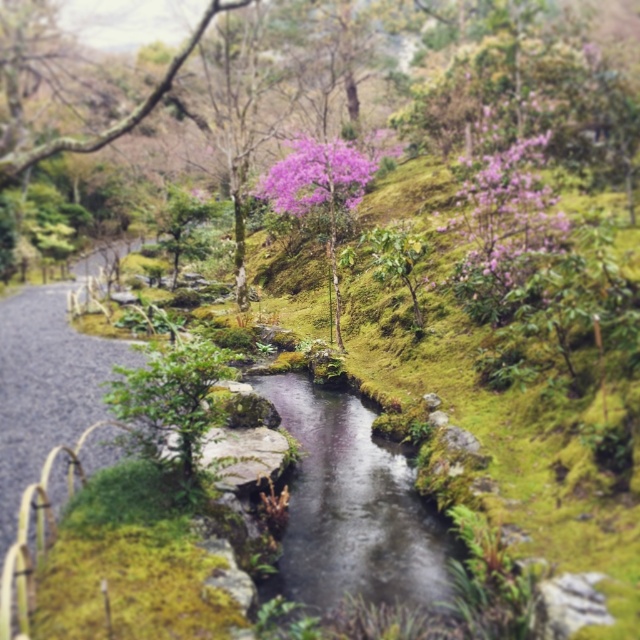
You are a hiker who wants to cross the clear water stream at center without getting your shoes wet. There is a purple matte flower at center nearby. Which object is shorter, allowing you to step over it easily?

The clear water stream at center has a lesser height compared to the purple matte flower at center. Therefore, the clear water stream at center is shorter and easier to step over without getting your shoes wet.

You are a hiker standing on the gravel path and want to pick both the purple matte flowers at upper right and the purple matte flower at center. Which flower should you approach first to reach the one that is closer to you?

You should approach the purple matte flowers at upper right first because it is closer to you than the purple matte flower at center, which is further away.